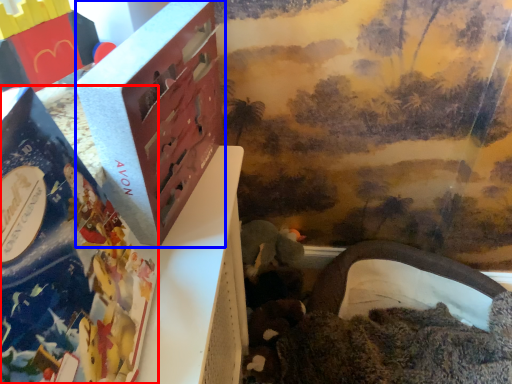
Question: Among these objects, which one is farthest to the camera, book (highlighted by a red box) or box (highlighted by a blue box)?

Choices:
 (A) book
 (B) box

Answer: (B)